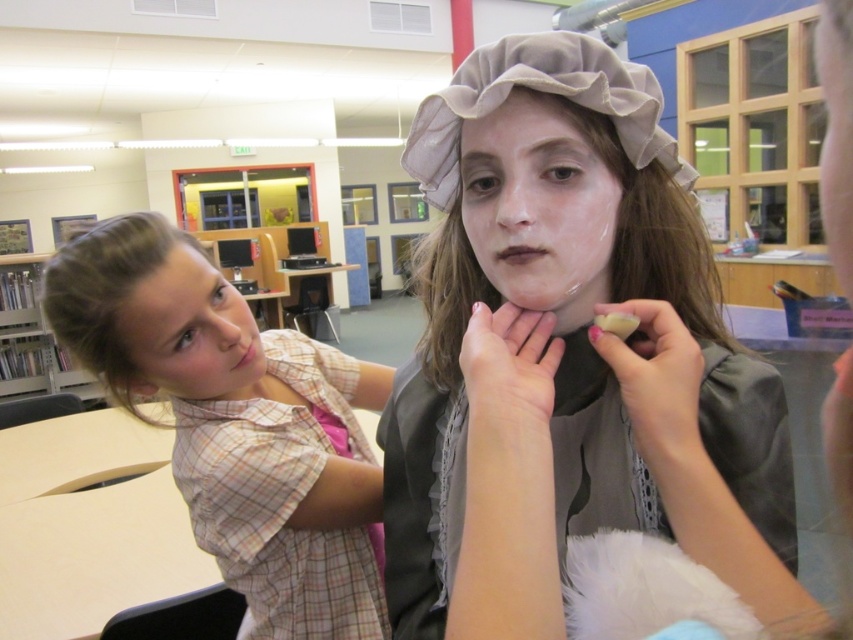
Question: Does plaid shirt at center have a smaller size compared to wooden bookshelf at left?

Choices:
 (A) no
 (B) yes

Answer: (B)

Question: Which point is farther to the camera?

Choices:
 (A) matte gray fabric hat at center
 (B) wooden bookshelf at left
 (C) matte white face at center

Answer: (B)

Question: Is light brown hair at left smaller than wooden bookshelf at left?

Choices:
 (A) no
 (B) yes

Answer: (B)

Question: Which object is positioned closest to the light brown hair at left?

Choices:
 (A) matte white face at center
 (B) wooden bookshelf at left
 (C) matte gray fabric hat at center
 (D) plaid shirt at center

Answer: (D)

Question: Does plaid shirt at center have a larger size compared to matte white face at center?

Choices:
 (A) yes
 (B) no

Answer: (A)

Question: Which of the following is the farthest from the observer?

Choices:
 (A) (577, 304)
 (B) (466, 177)
 (C) (6, 348)

Answer: (C)